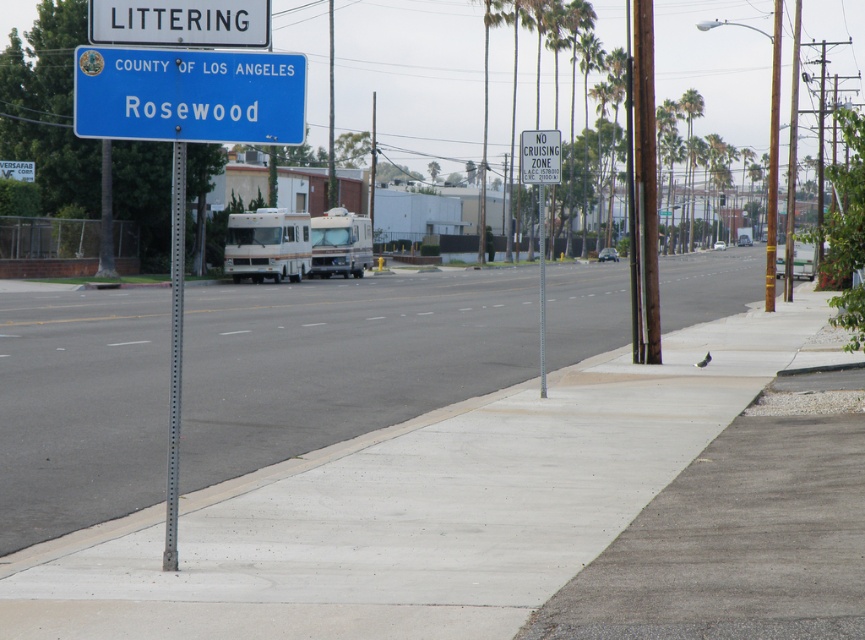
You are a pedestrian standing on the gray concrete sidewalk at center. You want to walk to the white plastic sign at upper center. Which direction should you move to reach it?

The gray concrete sidewalk at center is positioned on the left side of the white plastic sign at upper center, so you should move to your right to reach the white plastic sign at upper center.

You are a city inspector checking the placement of signs along the sidewalk. According to the standard, the LITTERING sign must be placed above the COUNTY OF LOS ANGELES Rosewood sign. Are the white plastic littering sign at upper center and the white plastic sign at upper center positioned correctly?

The white plastic littering sign at upper center is located below the white plastic sign at upper center, so the signs are not positioned correctly according to the standard requirement that the LITTERING sign must be above the COUNTY OF LOS ANGELES Rosewood sign.